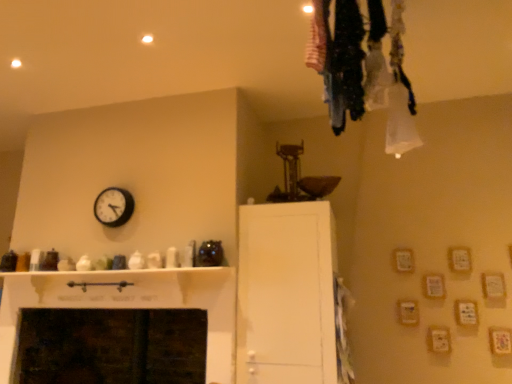
Identify the location of white plastic clock at upper left. This screenshot has height=384, width=512. (113, 206).

What do you see at coordinates (113, 206) in the screenshot? Image resolution: width=512 pixels, height=384 pixels. I see `white plastic clock at upper left` at bounding box center [113, 206].

Identify the location of white matte cabinet at center. (286, 294).

This screenshot has height=384, width=512. Describe the element at coordinates (286, 294) in the screenshot. I see `white matte cabinet at center` at that location.

I want to click on white plastic clock at upper left, so click(x=113, y=206).

Can you confirm if white matte cabinet at center is positioned to the left of white plastic clock at upper left?

No, white matte cabinet at center is not to the left of white plastic clock at upper left.

Is white matte cabinet at center positioned before white plastic clock at upper left?

Yes, the depth of white matte cabinet at center is less than that of white plastic clock at upper left.

Considering the positions of points (277, 330) and (122, 194), is point (277, 330) farther from camera compared to point (122, 194)?

No, it is not.

From the image's perspective, between white matte cabinet at center and white plastic clock at upper left, which one is located above?

white plastic clock at upper left appears higher in the image.

From a real-world perspective, which is physically above, white matte cabinet at center or white plastic clock at upper left?

white plastic clock at upper left is physically above.

Which object is thinner, white matte cabinet at center or white plastic clock at upper left?

white plastic clock at upper left is thinner.

In terms of height, does white matte cabinet at center look taller or shorter compared to white plastic clock at upper left?

In the image, white matte cabinet at center appears to be taller than white plastic clock at upper left.

Between white matte cabinet at center and white plastic clock at upper left, which one has smaller size?

With smaller size is white plastic clock at upper left.

Is white matte cabinet at center not inside white plastic clock at upper left?

That's correct, white matte cabinet at center is outside of white plastic clock at upper left.

Is white matte cabinet at center beside white plastic clock at upper left?

There is a gap between white matte cabinet at center and white plastic clock at upper left.

Is white matte cabinet at center turned away from white plastic clock at upper left?

No, white plastic clock at upper left is not at the back of white matte cabinet at center.

The height and width of the screenshot is (384, 512). In order to click on cabinetry on the right side of white plastic clock at upper left in this screenshot , I will do `click(286, 294)`.

Based on the photo, can you confirm if white plastic clock at upper left is positioned to the right of white matte cabinet at center?

In fact, white plastic clock at upper left is to the left of white matte cabinet at center.

Which object is further away from the camera taking this photo, white plastic clock at upper left or white matte cabinet at center?

white plastic clock at upper left is further away from the camera.

Which is behind, point (118, 212) or point (293, 231)?

The point (118, 212) is farther from the camera.

From the image's perspective, does white plastic clock at upper left appear lower than white matte cabinet at center?

No, from the image's perspective, white plastic clock at upper left is not below white matte cabinet at center.

From a real-world perspective, which object stands above the other?

In real-world perspective, white plastic clock at upper left is above.

Considering the sizes of objects white plastic clock at upper left and white matte cabinet at center in the image provided, who is thinner, white plastic clock at upper left or white matte cabinet at center?

Thinner between the two is white plastic clock at upper left.

Which of these two, white plastic clock at upper left or white matte cabinet at center, stands taller?

Standing taller between the two is white matte cabinet at center.

Considering the relative sizes of white plastic clock at upper left and white matte cabinet at center in the image provided, is white plastic clock at upper left bigger than white matte cabinet at center?

Incorrect, white plastic clock at upper left is not larger than white matte cabinet at center.

Is white plastic clock at upper left inside the boundaries of white matte cabinet at center, or outside?

white plastic clock at upper left lies outside white matte cabinet at center.

Is white plastic clock at upper left far from white matte cabinet at center?

Yes, white plastic clock at upper left is far from white matte cabinet at center.

Is white plastic clock at upper left facing away from white matte cabinet at center?

No, white plastic clock at upper left is not facing the opposite direction of white matte cabinet at center.

Identify the location of cabinetry beneath the white plastic clock at upper left (from a real-world perspective). Image resolution: width=512 pixels, height=384 pixels. (286, 294).

You are a GUI agent. You are given a task and a screenshot of the screen. Output one action in this format:
    pyautogui.click(x=<x>, y=<y>)
    Task: Click on the wall clock located on the left of white matte cabinet at center
    This screenshot has width=512, height=384.
    Given the screenshot: What is the action you would take?
    pyautogui.click(x=113, y=206)

The width and height of the screenshot is (512, 384). I want to click on wall clock that appears above the white matte cabinet at center (from a real-world perspective), so click(113, 206).